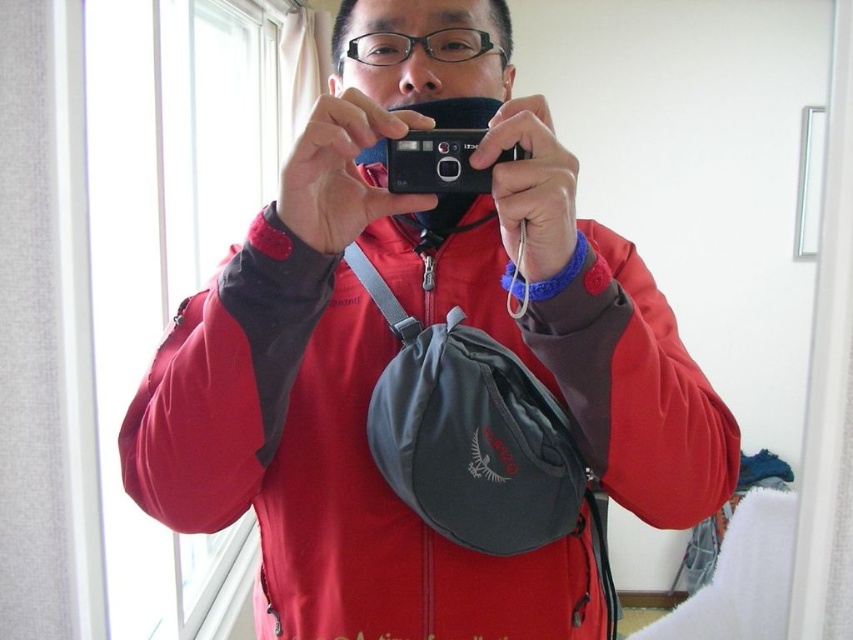
Who is more forward, (456,573) or (428,172)?

Point (428,172) is in front.

Which of these two, matte red jacket at center or black plastic camera at center, stands shorter?

Standing shorter between the two is black plastic camera at center.

Between point (508, 346) and point (436, 161), which one is positioned in front?

Point (436, 161) is more forward.

You are a GUI agent. You are given a task and a screenshot of the screen. Output one action in this format:
    pyautogui.click(x=<x>, y=<y>)
    Task: Click on the matte red jacket at center
    
    Given the screenshot: What is the action you would take?
    pyautogui.click(x=320, y=465)